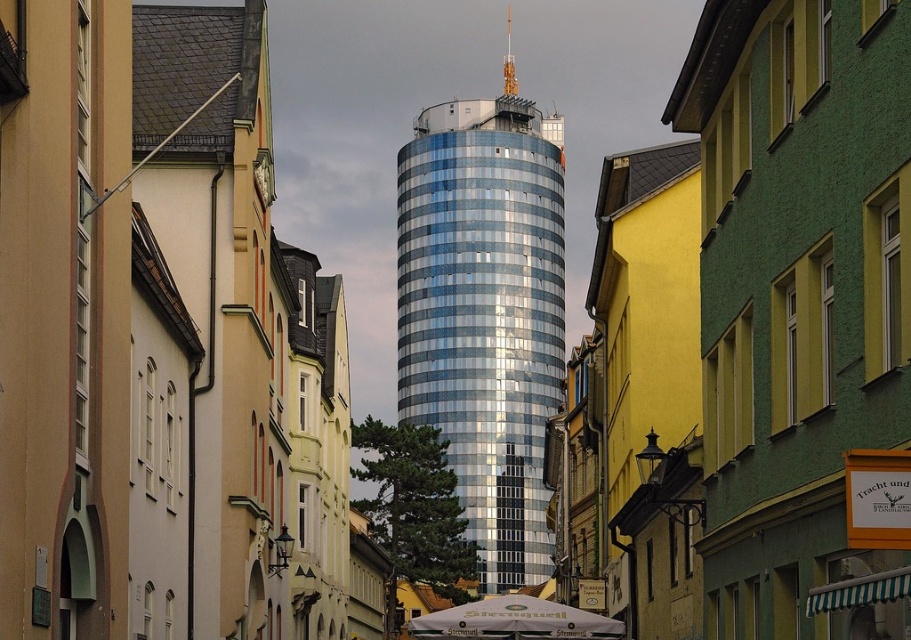
You are standing on the sidewalk in front of the green textured building at right and want to look up at the sleek metallic tower at center. Which direction should you turn your head to see it?

The green textured building at right is positioned under the sleek metallic tower at center, so you should look upward to see the sleek metallic tower at center.

You are a photographer standing on the sidewalk in this urban scene. You want to capture both the green textured building at right and the white fabric umbrella at center in a single shot. Which object will appear smaller in your photo?

The green textured building at right will appear smaller in the photo since it occupies less space than the white fabric umbrella at center according to the description.

You are standing in the urban scene and want to determine the relative positions of two points. Which point is closer to you, the point at coordinates point (742, 577) or point (520, 410)?

Point (742, 577) is closer to the viewer than point (520, 410).